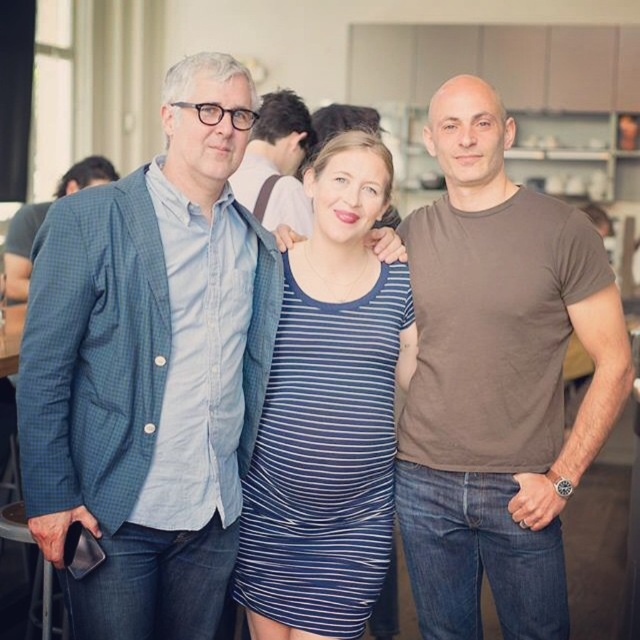
In the scene, there are two blue items at the center of the image. The blue striped dress at center and the matte blue shirt at center. Which one is taller?

The blue striped dress at center is much taller as matte blue shirt at center.

Based on the coordinates provided, which object is located at point (150, 369)?

The point (150, 369) marks the blue checkered blazer at center.

You are standing in the same room as the people in the image. The blue checkered blazer at center is part of the scene. If you want to reach into your pocket to get your keys, which is 0.5 feet away from you, will you be able to do so without moving closer to the blazer?

Yes, you can reach your keys without moving closer because the blue checkered blazer at center is 5.77 feet away, which is much farther than the 0.5 feet needed to access your pocket.